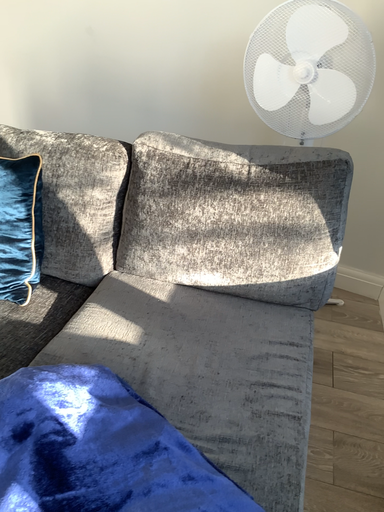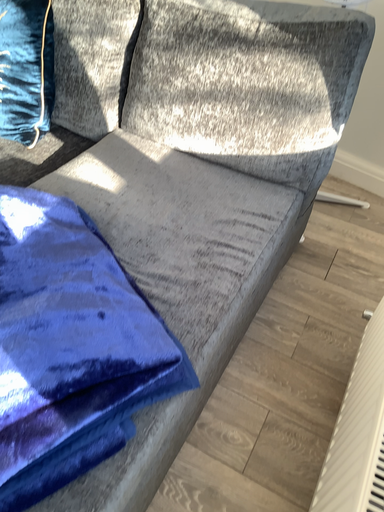
Question: How did the camera likely rotate when shooting the video?

Choices:
 (A) rotated downward
 (B) rotated upward

Answer: (A)